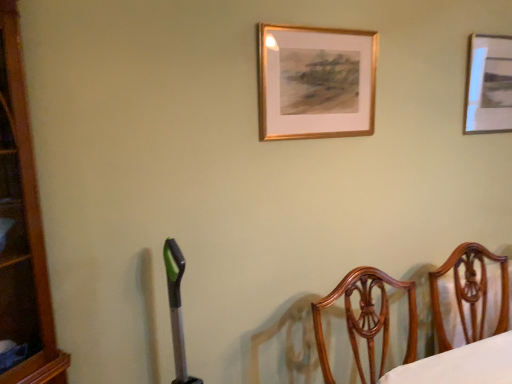
Question: Is point (454, 286) positioned closer to the camera than point (342, 134)?

Choices:
 (A) farther
 (B) closer

Answer: (A)

Question: From a real-world perspective, is wooden chair at right positioned above or below gold wooden picture frame at upper center, the second picture frame when ordered from back to front?

Choices:
 (A) below
 (B) above

Answer: (A)

Question: Which is farther from the gold wooden picture frame at upper center, acting as the first picture frame starting from the left?

Choices:
 (A) metallic silver picture frame at upper right, which is counted as the second picture frame, starting from the front
 (B) wooden chair at right

Answer: (B)

Question: Estimate the real-world distances between objects in this image. Which object is closer to the metallic silver picture frame at upper right, the second picture frame viewed from the left?

Choices:
 (A) wooden chair at right
 (B) gold wooden picture frame at upper center, which appears as the first picture frame when viewed from the front

Answer: (B)